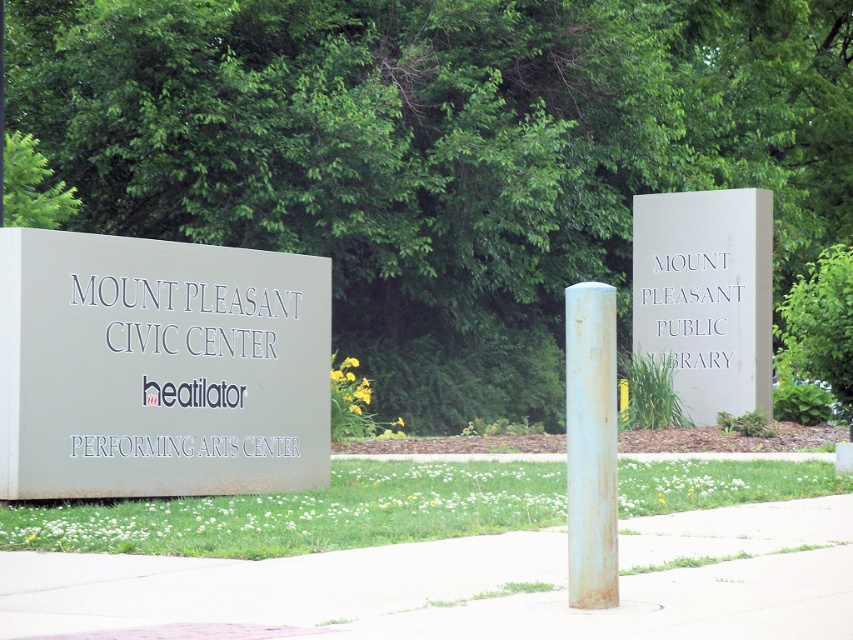
You are standing in front of the two large signs at the entrance. There are two points marked on the signs. One is at point coordinates point (144, 355) and the other is at point (688, 412). Which point is closer to you?

Point (144, 355) is closer to the camera than point (688, 412), so the point at coordinates point (144, 355) is closer to you.

You are a delivery driver approaching the civic center and library complex. You need to park near the rusty metal pole at center. Which direction should you drive relative to the matte gray sign at left to reach the pole?

The matte gray sign at left is positioned on the left side of the rusty metal pole at center, so you should drive to the right of the matte gray sign at left to reach the rusty metal pole at center.

You are standing in front of the two signs at the entrance. You notice two points marked on the signs. The first point is at coordinates point [755,378], and the second point is at point [608,396]. Which point is closer to you?

Point [608,396] is closer to you because it is less further to the viewer than point [755,378].